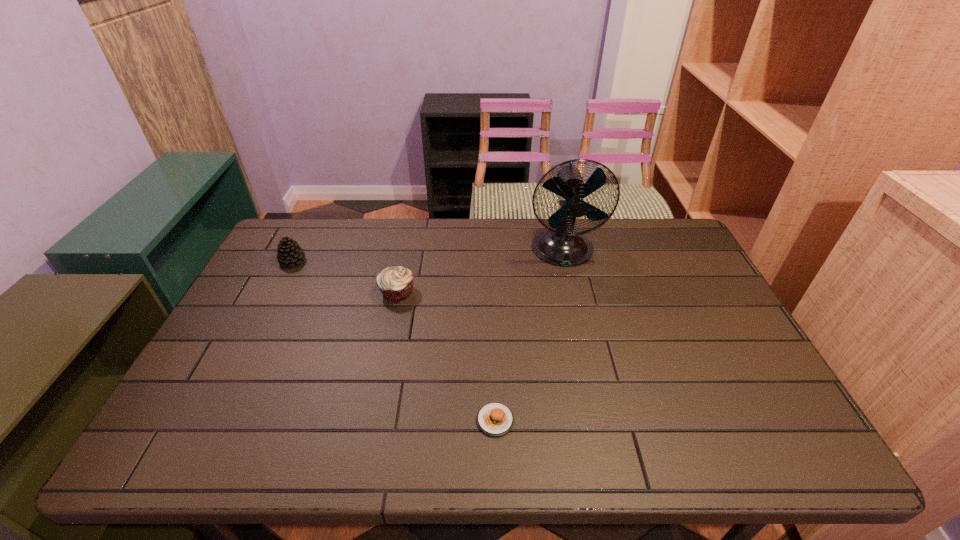
In order to click on vacant area that lies between the tallest object and the pinecone in this screenshot , I will do `click(428, 256)`.

Find the location of a particular element. Image resolution: width=960 pixels, height=540 pixels. unoccupied area between the fan and the muffin is located at coordinates (480, 271).

Find the location of `object that is the third closest to the tallest object`. object that is the third closest to the tallest object is located at coordinates (290, 253).

At what (x,y) coordinates should I click in order to perform the action: click on object identified as the third closest to the rightmost object. Please return your answer as a coordinate pair (x, y). Looking at the image, I should click on (290, 253).

You are a GUI agent. You are given a task and a screenshot of the screen. Output one action in this format:
    pyautogui.click(x=<x>, y=<y>)
    Task: Click on the blank space that satisfies the following two spatial constraints: 1. at the narrow end of the leftmost object; 2. on the back side of the shortest object
    
    Given the screenshot: What is the action you would take?
    pyautogui.click(x=212, y=420)

Where is `vacant space that satisfies the following two spatial constraints: 1. at the narrow end of the pinecone; 2. on the left side of the food`? vacant space that satisfies the following two spatial constraints: 1. at the narrow end of the pinecone; 2. on the left side of the food is located at coordinates (212, 420).

At what (x,y) coordinates should I click in order to perform the action: click on vacant space that satisfies the following two spatial constraints: 1. on the front-facing side of the fan; 2. at the narrow end of the pinecone. Please return your answer as a coordinate pair (x, y). Image resolution: width=960 pixels, height=540 pixels. Looking at the image, I should click on (565, 261).

You are a GUI agent. You are given a task and a screenshot of the screen. Output one action in this format:
    pyautogui.click(x=<x>, y=<y>)
    Task: Click on the vacant space that satisfies the following two spatial constraints: 1. on the front side of the second object from left to right; 2. on the left side of the nearest object
    
    Given the screenshot: What is the action you would take?
    pyautogui.click(x=371, y=420)

This screenshot has width=960, height=540. Find the location of `free point that satisfies the following two spatial constraints: 1. on the front-facing side of the rightmost object; 2. at the narrow end of the pinecone`. free point that satisfies the following two spatial constraints: 1. on the front-facing side of the rightmost object; 2. at the narrow end of the pinecone is located at coordinates (565, 261).

You are a GUI agent. You are given a task and a screenshot of the screen. Output one action in this format:
    pyautogui.click(x=<x>, y=<y>)
    Task: Click on the free space that satisfies the following two spatial constraints: 1. at the narrow end of the pinecone; 2. on the right side of the nearest object
    
    Given the screenshot: What is the action you would take?
    pyautogui.click(x=212, y=420)